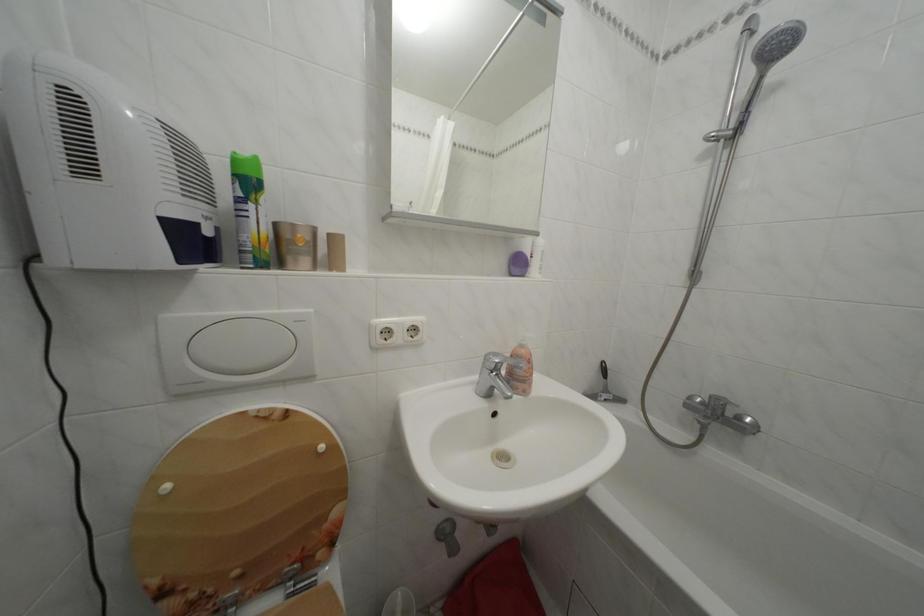
Identify the location of shower head slider. The width and height of the screenshot is (924, 616). (723, 134).